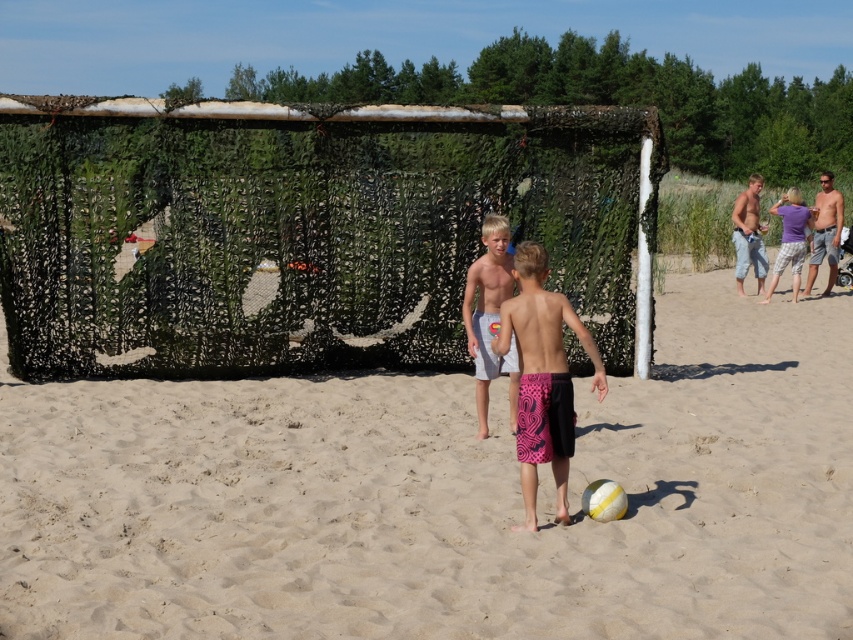
You are a photographer trying to capture both the white cotton shorts at center and the purple cotton shirt at upper right in a single frame. Based on their heights, which one should you focus on first to ensure both are in focus?

The white cotton shorts at center has a lesser height compared to purple cotton shirt at upper right. Therefore, you should focus on the purple cotton shirt at upper right first to ensure both are in focus since focusing on the taller object first can help maintain clarity for the shorter one in the depth of field.

You are a drone operator trying to locate a specific point on the beach soccer goal. The point you need to find is at coordinates point (x=444, y=497). Based on the scene description, where would this point be located?

The point (x=444, y=497) is located on the camouflage netting at center, which is part of the makeshift soccer goal.